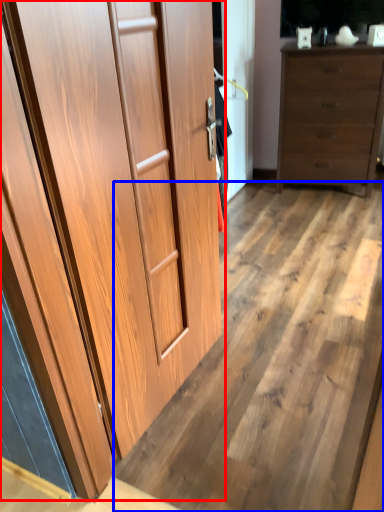
Question: Among these objects, which one is farthest to the camera, cupboard (highlighted by a red box) or plywood (highlighted by a blue box)?

Choices:
 (A) cupboard
 (B) plywood

Answer: (B)